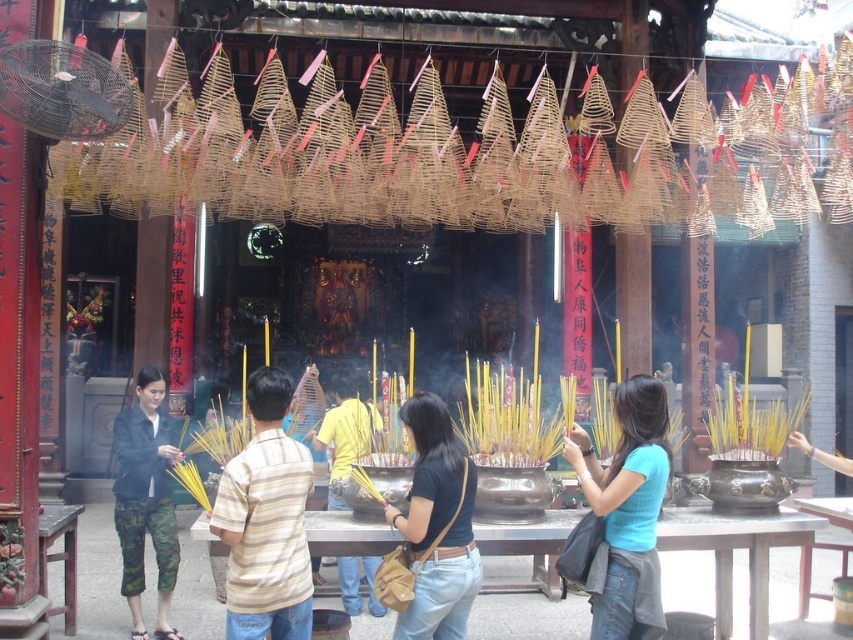
Question: Can you confirm if striped cotton shirt at center is positioned above black leather bag at center?

Choices:
 (A) no
 (B) yes

Answer: (B)

Question: Can you confirm if striped cotton shirt at center is positioned above blue cotton shirt at center?

Choices:
 (A) no
 (B) yes

Answer: (B)

Question: Which of the following is the closest to the observer?

Choices:
 (A) blue cotton shirt at center
 (B) camouflage pants at lower left
 (C) black leather bag at center
 (D) striped cotton shirt at center

Answer: (D)

Question: Among these points, which one is farthest from the camera?

Choices:
 (A) (289, 618)
 (B) (418, 540)

Answer: (B)

Question: Can you confirm if blue cotton shirt at center is positioned below camouflage pants at lower left?

Choices:
 (A) no
 (B) yes

Answer: (A)

Question: Which point is farther to the camera?

Choices:
 (A) (236, 618)
 (B) (439, 449)
 (C) (653, 548)

Answer: (B)